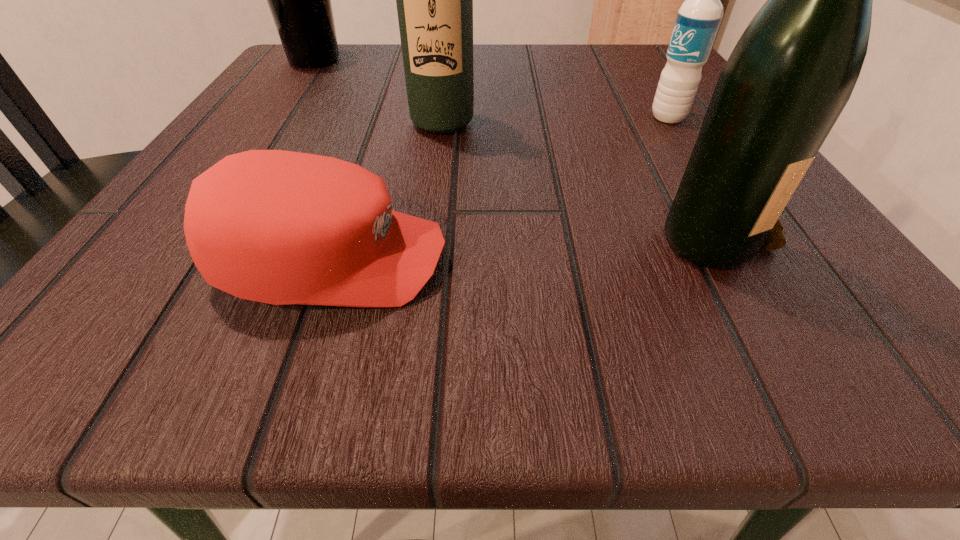
Where is `free space located 0.340m on the label of the water bottle`? Image resolution: width=960 pixels, height=540 pixels. free space located 0.340m on the label of the water bottle is located at coordinates (428, 117).

Find the location of `vacant space located on the label of the water bottle`. vacant space located on the label of the water bottle is located at coordinates (487, 117).

Find the location of a particular element. Image resolution: width=960 pixels, height=540 pixels. free region located on the front-facing side of the shortest object is located at coordinates (620, 261).

Find the location of a particular element. object that is positioned at the far edge is located at coordinates (299, 0).

Locate an element on the screen. Image resolution: width=960 pixels, height=540 pixels. object located in the near edge section of the desktop is located at coordinates (279, 227).

This screenshot has width=960, height=540. I want to click on wine bottle at the left edge, so click(x=299, y=0).

This screenshot has height=540, width=960. I want to click on cap present at the left edge, so 279,227.

I want to click on wine bottle at the right edge, so [793, 70].

Locate an element on the screen. This screenshot has height=540, width=960. water bottle at the right edge is located at coordinates (698, 19).

Where is `object present at the far left corner`? object present at the far left corner is located at coordinates (299, 0).